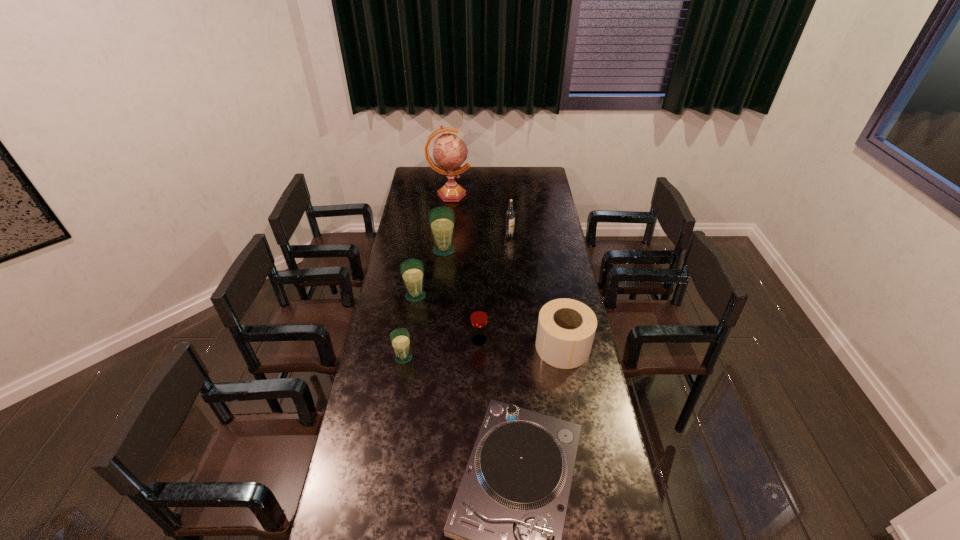
Find the location of `object situated at the right edge`. object situated at the right edge is located at coordinates (566, 328).

Where is `free space at the left edge of the desktop`? This screenshot has height=540, width=960. free space at the left edge of the desktop is located at coordinates (397, 391).

You are a GUI agent. You are given a task and a screenshot of the screen. Output one action in this format:
    pyautogui.click(x=<x>, y=<y>)
    Task: Click on the vacant position at the right edge of the desktop
    The height and width of the screenshot is (540, 960).
    Given the screenshot: What is the action you would take?
    pyautogui.click(x=614, y=532)

Find the location of a particular element. This screenshot has width=960, height=540. free location at the far left corner is located at coordinates (424, 185).

Where is `empty location between the nearest blue glass and the second nearest glass`? empty location between the nearest blue glass and the second nearest glass is located at coordinates [442, 349].

This screenshot has width=960, height=540. In order to click on free spot between the smallest blue glass and the toilet tissue in this screenshot , I will do `click(483, 352)`.

I want to click on empty space between the tallest object and the vodka, so click(x=480, y=215).

What are the coordinates of `vacant area between the farthest blue glass and the second farthest glass` in the screenshot? It's located at (430, 273).

Identify which object is the fifth nearest to the pink globe. Please provide its 2D coordinates. Your answer should be formatted as a tuple, i.e. [(x, y)], where the tuple contains the x and y coordinates of a point satisfying the conditions above.

[(478, 317)]

The width and height of the screenshot is (960, 540). Find the location of `object that is the sixth closest to the tallest object`. object that is the sixth closest to the tallest object is located at coordinates (400, 339).